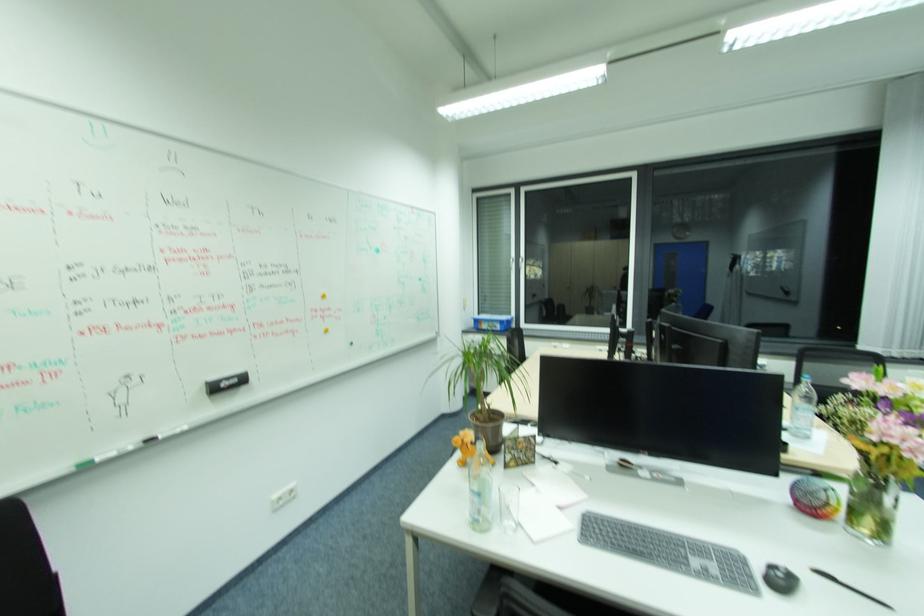
Describe the element at coordinates (492, 322) in the screenshot. I see `the blue storage box` at that location.